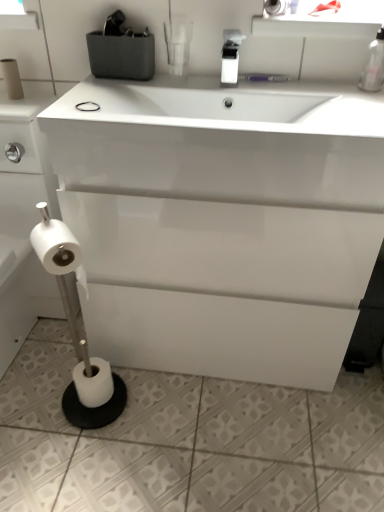
Locate an element on the screen. The height and width of the screenshot is (512, 384). vacant area that lies to the right of white glossy soap dispenser at upper center, the 2th bottle in the right-to-left sequence is located at coordinates (282, 88).